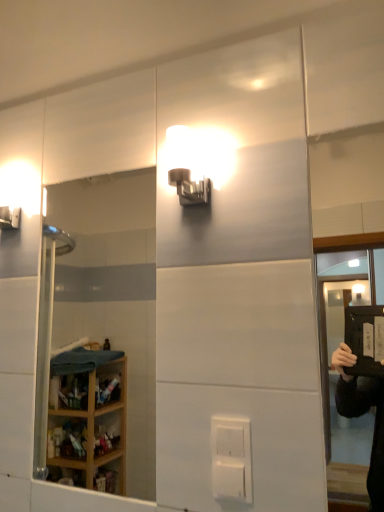
Question: From a real-world perspective, is clear glass mirror at left positioned over transparent plastic screen door at upper right based on gravity?

Choices:
 (A) yes
 (B) no

Answer: (B)

Question: Is clear glass mirror at left positioned with its back to transparent plastic screen door at upper right?

Choices:
 (A) yes
 (B) no

Answer: (B)

Question: Is clear glass mirror at left oriented towards transparent plastic screen door at upper right?

Choices:
 (A) no
 (B) yes

Answer: (A)

Question: Considering the relative sizes of clear glass mirror at left and transparent plastic screen door at upper right in the image provided, is clear glass mirror at left thinner than transparent plastic screen door at upper right?

Choices:
 (A) no
 (B) yes

Answer: (B)

Question: Is the position of clear glass mirror at left more distant than that of transparent plastic screen door at upper right?

Choices:
 (A) yes
 (B) no

Answer: (A)

Question: Based on their positions, is white plastic electric outlet at center located to the left or right of matte white sconce at upper center?

Choices:
 (A) left
 (B) right

Answer: (B)

Question: Is point (233, 498) closer or farther from the camera than point (178, 162)?

Choices:
 (A) farther
 (B) closer

Answer: (B)

Question: From the image's perspective, is white plastic electric outlet at center located above or below matte white sconce at upper center?

Choices:
 (A) above
 (B) below

Answer: (B)

Question: Is white plastic electric outlet at center wider or thinner than matte white sconce at upper center?

Choices:
 (A) thin
 (B) wide

Answer: (A)

Question: From a real-world perspective, is white plastic electric outlet at center above or below transparent plastic screen door at upper right?

Choices:
 (A) below
 (B) above

Answer: (A)

Question: Is white plastic electric outlet at center wider or thinner than transparent plastic screen door at upper right?

Choices:
 (A) thin
 (B) wide

Answer: (B)

Question: Is point (238, 467) closer or farther from the camera than point (327, 418)?

Choices:
 (A) farther
 (B) closer

Answer: (B)

Question: From the image's perspective, is white plastic electric outlet at center above or below transparent plastic screen door at upper right?

Choices:
 (A) below
 (B) above

Answer: (A)

Question: Is clear glass mirror at left in front of or behind white plastic electric outlet at center in the image?

Choices:
 (A) behind
 (B) front

Answer: (A)

Question: Choose the correct answer: Is clear glass mirror at left inside white plastic electric outlet at center or outside it?

Choices:
 (A) inside
 (B) outside

Answer: (B)